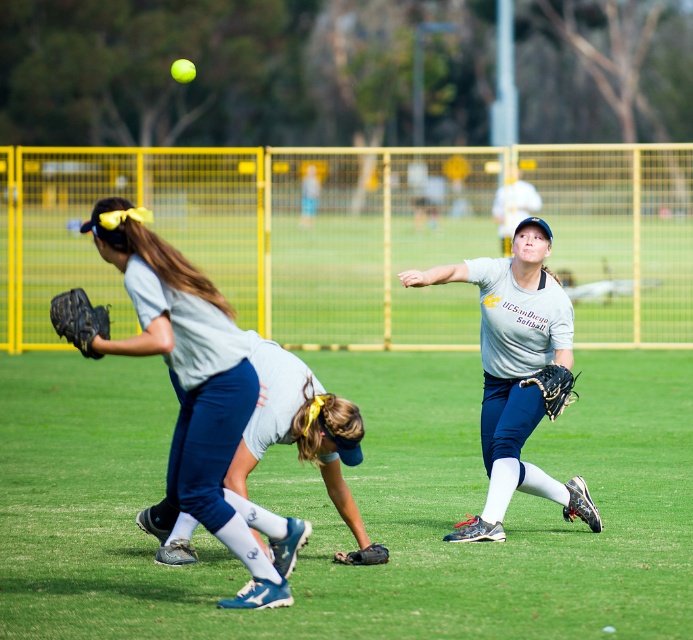
You are a spectator trying to take a photo of the light gray jersey at center and the black leather glove at left. Which object should you focus on first if you want to capture both clearly in your photo?

You should focus on the light gray jersey at center first because it is in front of the black leather glove at left, ensuring both will be in focus when starting with the closer object.

You are a photographer trying to capture a closeup of the matte gray shirt at center and the black leather baseball glove at center. Which object should you focus on first if you want to ensure both are in focus without adjusting your camera settings?

The matte gray shirt at center is taller than the black leather baseball glove at center, so focusing on the matte gray shirt at center first would help ensure both are in focus since it is larger in the frame.

You are a player in the softball game and need to throw the ball to a teammate. You are currently at point (486, 301). Your teammate is at point (545, 374). Which direction should you throw the ball to reach them?

You should throw the ball forward towards point (545, 374) because point (486, 301) is behind it according to the spatial coordinates provided.